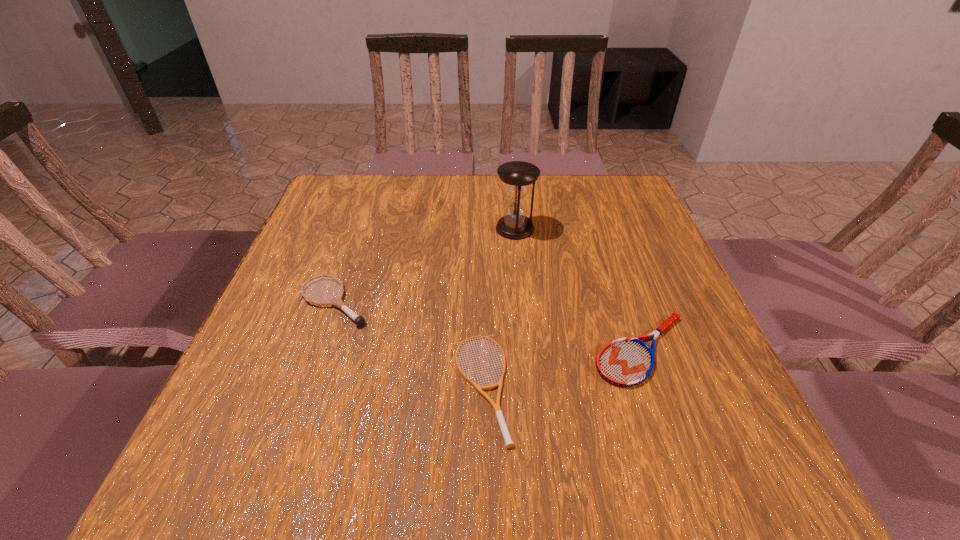
Locate an element on the screen. vacant space in between the second tennis racket from right to left and the third shortest object is located at coordinates (407, 344).

Locate an element on the screen. The image size is (960, 540). free space between the tallest object and the leftmost object is located at coordinates (424, 265).

You are a GUI agent. You are given a task and a screenshot of the screen. Output one action in this format:
    pyautogui.click(x=<x>, y=<y>)
    Task: Click on the empty space between the tallest object and the rightmost object
    
    Given the screenshot: What is the action you would take?
    pyautogui.click(x=579, y=289)

In order to click on free space between the second tennis racket from left to right and the hourglass in this screenshot , I will do `click(497, 307)`.

Where is `free spot between the tallest object and the second tennis racket from right to left`? This screenshot has width=960, height=540. free spot between the tallest object and the second tennis racket from right to left is located at coordinates (497, 307).

Locate an element on the screen. The image size is (960, 540). free space between the farthest object and the leftmost tennis racket is located at coordinates (424, 265).

This screenshot has width=960, height=540. I want to click on unoccupied position between the tallest object and the second tennis racket from left to right, so click(497, 307).

Where is `free space between the leftmost object and the second tennis racket from right to left`? The width and height of the screenshot is (960, 540). free space between the leftmost object and the second tennis racket from right to left is located at coordinates (407, 344).

The height and width of the screenshot is (540, 960). Identify the location of unoccupied area between the second tennis racket from right to left and the farthest object. (497, 307).

Locate an element on the screen. The width and height of the screenshot is (960, 540). free space between the second tennis racket from right to left and the leftmost object is located at coordinates (407, 344).